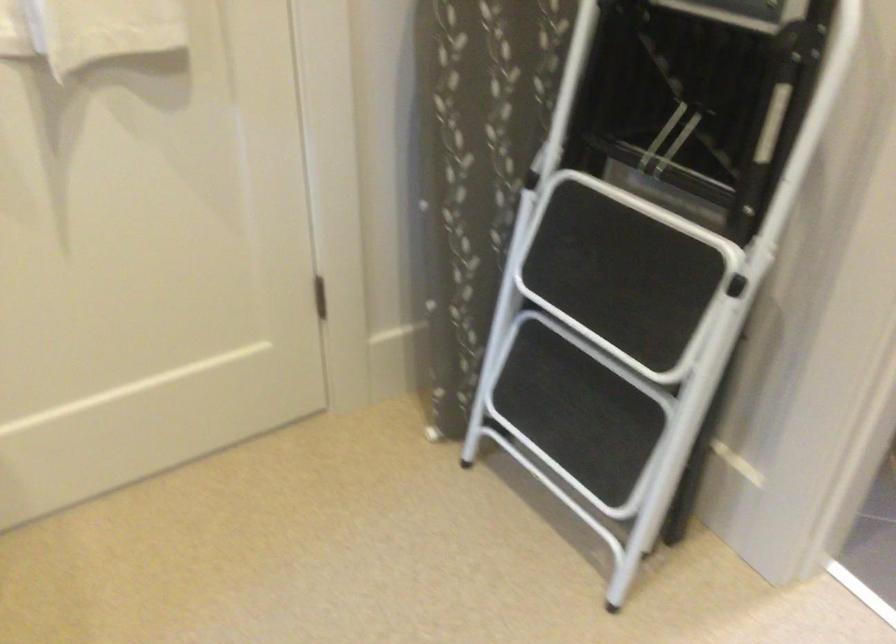
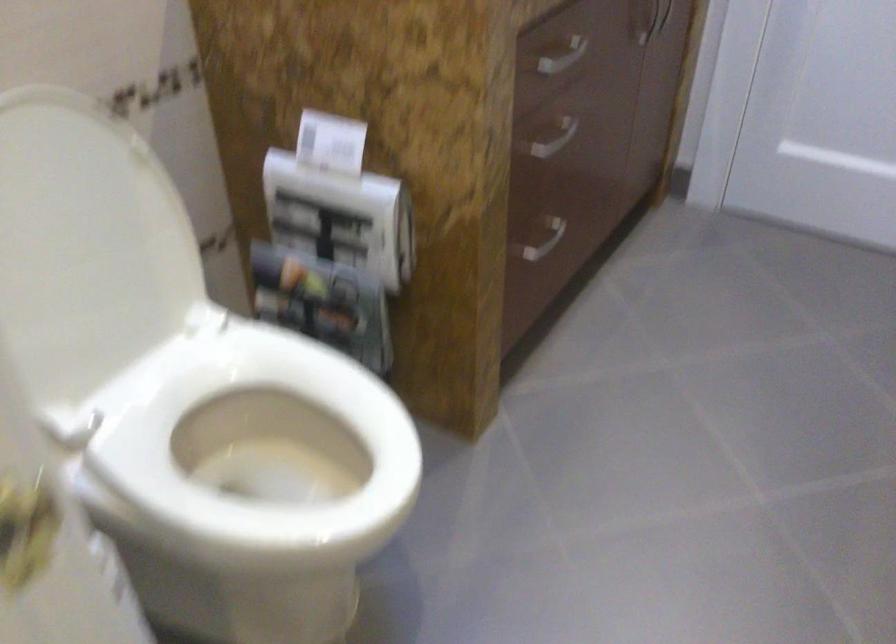
What movement of the cameraman would produce the second image?

The cameraman walked toward right, forward.